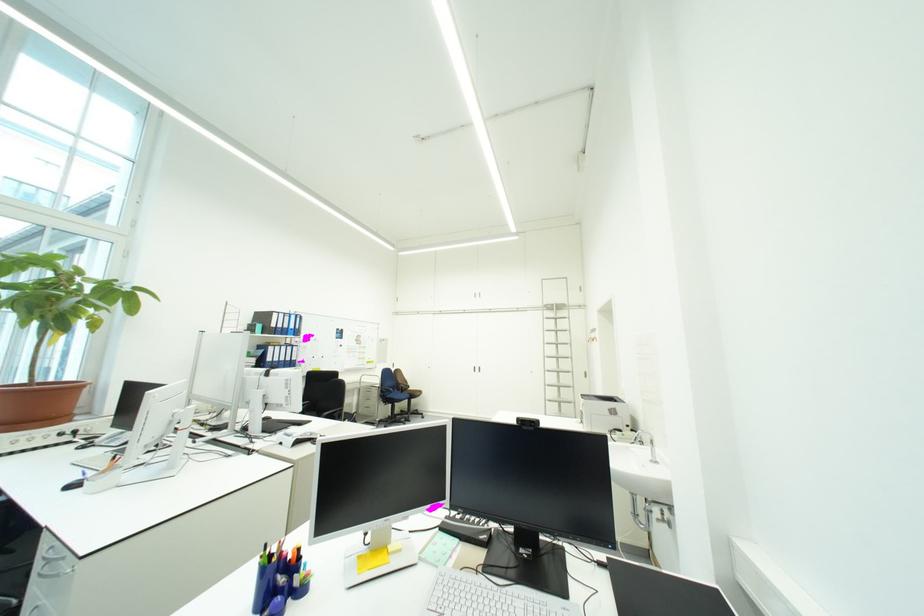
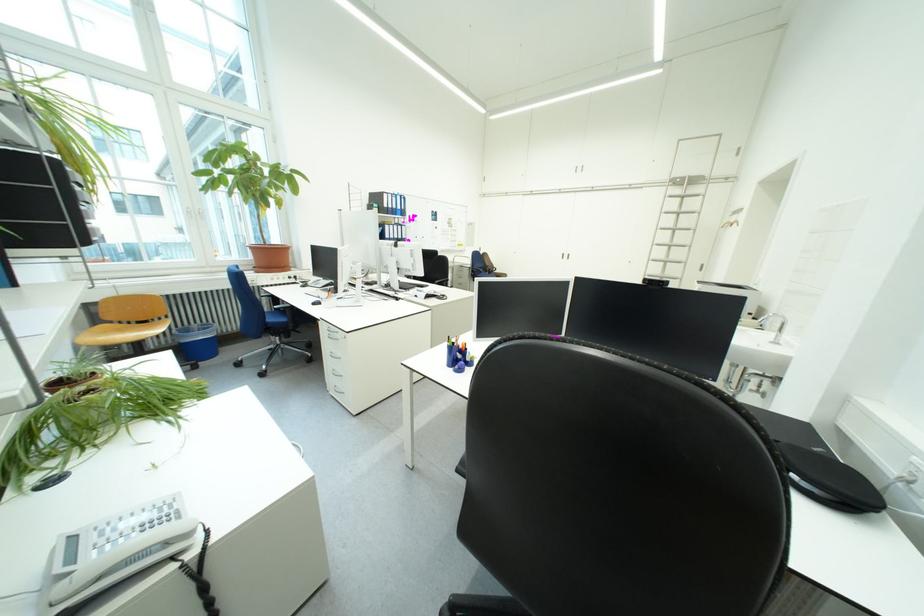
The point at (x=286, y=361) is marked in the first image. Where is the corresponding point in the second image?

(403, 238)